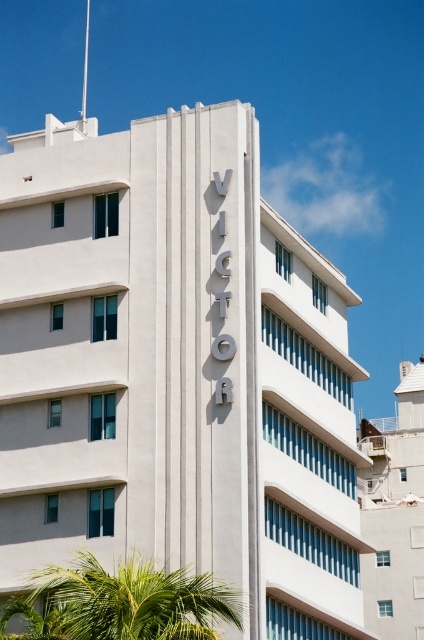
Is green leafy palm tree at lower left to the right of white smooth building at upper center from the viewer's perspective?

In fact, green leafy palm tree at lower left is to the left of white smooth building at upper center.

What do you see at coordinates (122, 604) in the screenshot?
I see `green leafy palm tree at lower left` at bounding box center [122, 604].

Is point (105, 627) farther from camera compared to point (415, 481)?

No, it is in front of (415, 481).

Where is `green leafy palm tree at lower left`? This screenshot has height=640, width=424. green leafy palm tree at lower left is located at coordinates (122, 604).